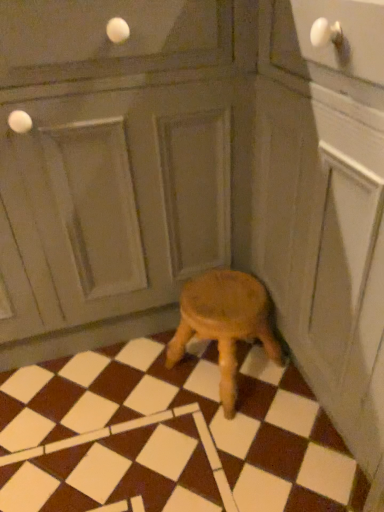
Question: Is matte gray screen door at center to the left of wooden stool at center from the viewer's perspective?

Choices:
 (A) no
 (B) yes

Answer: (B)

Question: Is matte gray screen door at center wider than wooden stool at center?

Choices:
 (A) no
 (B) yes

Answer: (B)

Question: Considering the relative sizes of matte gray screen door at center and wooden stool at center in the image provided, is matte gray screen door at center thinner than wooden stool at center?

Choices:
 (A) no
 (B) yes

Answer: (A)

Question: Does matte gray screen door at center come behind wooden stool at center?

Choices:
 (A) no
 (B) yes

Answer: (A)

Question: Can you confirm if matte gray screen door at center is positioned to the right of wooden stool at center?

Choices:
 (A) yes
 (B) no

Answer: (B)

Question: Do you think brown matte tile at center is within wooden stool at center, or outside of it?

Choices:
 (A) outside
 (B) inside

Answer: (A)

Question: Visually, is brown matte tile at center positioned to the left or to the right of wooden stool at center?

Choices:
 (A) left
 (B) right

Answer: (A)

Question: In the image, is brown matte tile at center positioned in front of or behind wooden stool at center?

Choices:
 (A) front
 (B) behind

Answer: (A)

Question: Considering the positions of brown matte tile at center and wooden stool at center in the image, is brown matte tile at center wider or thinner than wooden stool at center?

Choices:
 (A) thin
 (B) wide

Answer: (B)

Question: Does point (203, 283) appear closer or farther from the camera than point (178, 240)?

Choices:
 (A) farther
 (B) closer

Answer: (B)

Question: Considering the positions of wooden stool at center and matte gray screen door at center in the image, is wooden stool at center wider or thinner than matte gray screen door at center?

Choices:
 (A) wide
 (B) thin

Answer: (B)

Question: In the image, is wooden stool at center on the left side or the right side of matte gray screen door at center?

Choices:
 (A) right
 (B) left

Answer: (A)

Question: From a real-world perspective, is wooden stool at center physically located above or below matte gray screen door at center?

Choices:
 (A) above
 (B) below

Answer: (B)

Question: Is matte gray screen door at center in front of or behind brown matte tile at center in the image?

Choices:
 (A) behind
 (B) front

Answer: (B)

Question: From the image's perspective, is matte gray screen door at center located above or below brown matte tile at center?

Choices:
 (A) below
 (B) above

Answer: (B)